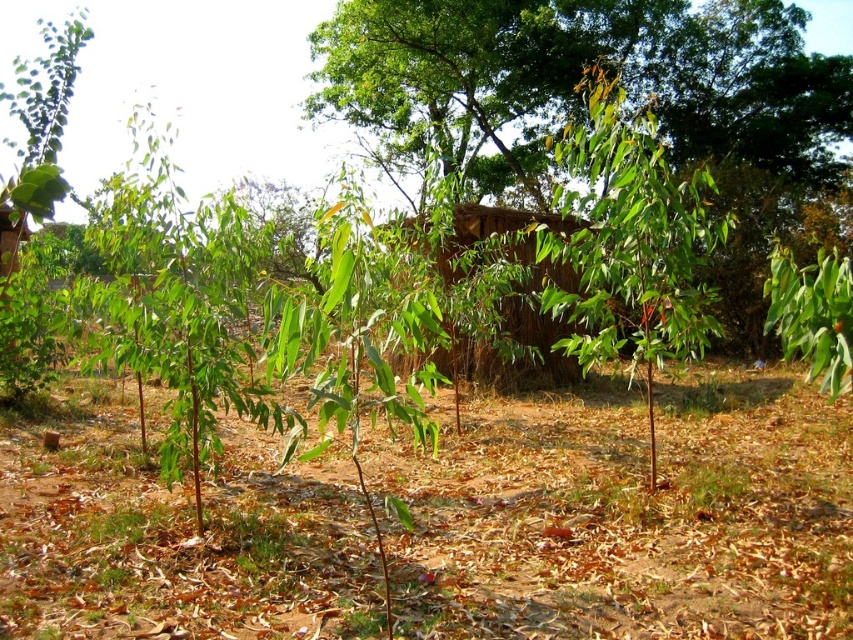
Between point (416, 502) and point (326, 51), which one is positioned behind?

The point (326, 51) is behind.

Does brown soil at center have a smaller size compared to green leafy tree at center?

Yes.

Which is in front, point (410, 588) or point (677, 67)?

Point (410, 588) is in front.

The image size is (853, 640). I want to click on brown soil at center, so click(625, 513).

The height and width of the screenshot is (640, 853). Identify the location of green leafy tree at center. (581, 76).

Between green leafy tree at center and green leafy plant at center, which one has less height?

green leafy plant at center is shorter.

In order to click on green leafy tree at center in this screenshot , I will do (581, 76).

Locate an element on the screen. green leafy tree at center is located at coordinates (581, 76).

Does brown soil at center lie in front of green leafy plant at center?

No, brown soil at center is behind green leafy plant at center.

Between point (846, 586) and point (648, 387), which one is positioned in front?

Point (846, 586) is more forward.

What are the coordinates of `brown soil at center` in the screenshot? It's located at (625, 513).